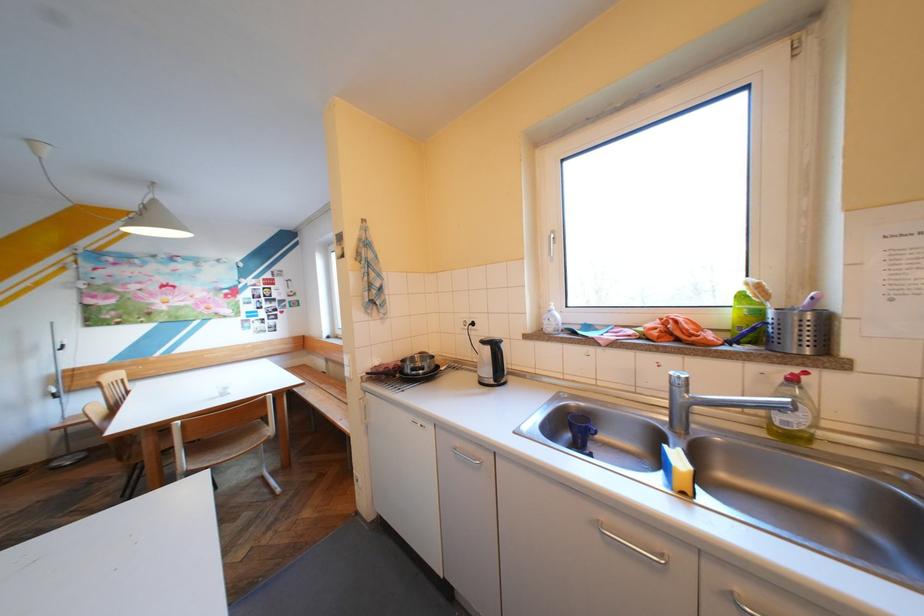
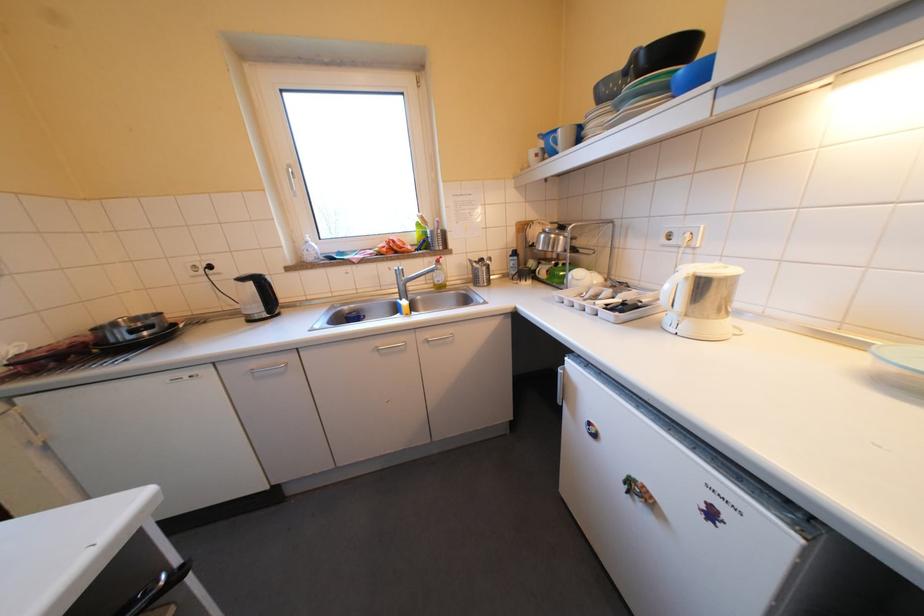
Question: How did the camera likely rotate?

Choices:
 (A) Left
 (B) Right
 (C) Up
 (D) Down

Answer: (B)